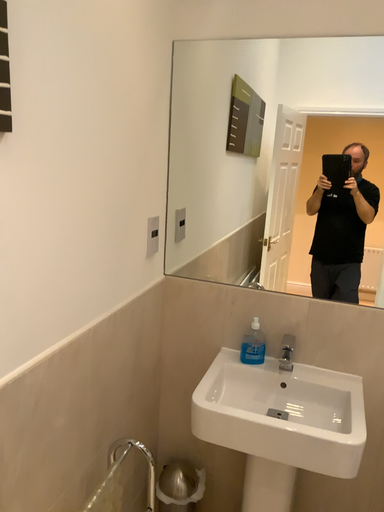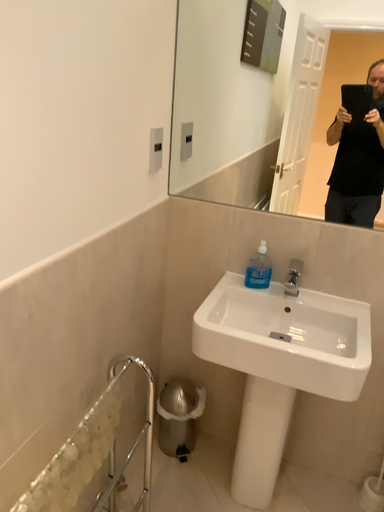
Question: How did the camera likely rotate when shooting the video?

Choices:
 (A) rotated upward
 (B) rotated downward

Answer: (B)